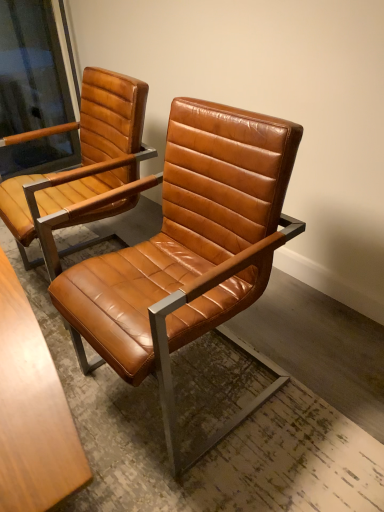
Question: Relative to cognac leather chair at center, positioned as the first chair in right-to-left order, is cognac leather chair at center, positioned as the second chair in right-to-left order, in front or behind?

Choices:
 (A) behind
 (B) front

Answer: (A)

Question: From the image's perspective, is cognac leather chair at center, positioned as the second chair in right-to-left order, positioned above or below cognac leather chair at center, positioned as the first chair in right-to-left order?

Choices:
 (A) above
 (B) below

Answer: (A)

Question: Estimate the real-world distances between objects in this image. Which object is farther from the cognac leather chair at center, which is counted as the 1th chair, starting from the left?

Choices:
 (A) matte brown leather chair arm at upper left
 (B) cognac leather chair at center, which is counted as the 2th chair, starting from the left

Answer: (A)

Question: Considering the real-world distances, which object is closest to the cognac leather chair at center, which is counted as the 2th chair, starting from the left?

Choices:
 (A) cognac leather chair at center, positioned as the second chair in right-to-left order
 (B) matte brown leather chair arm at upper left

Answer: (A)